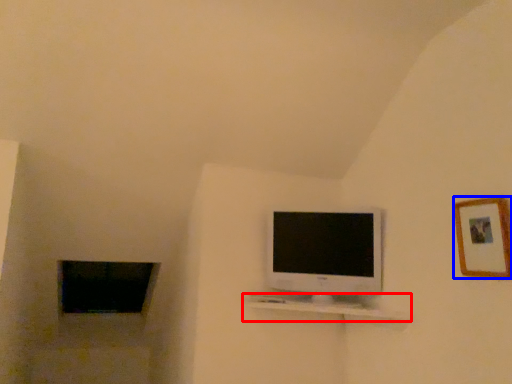
Question: Which object appears farthest to the camera in this image, shelf (highlighted by a red box) or picture frame (highlighted by a blue box)?

Choices:
 (A) shelf
 (B) picture frame

Answer: (A)